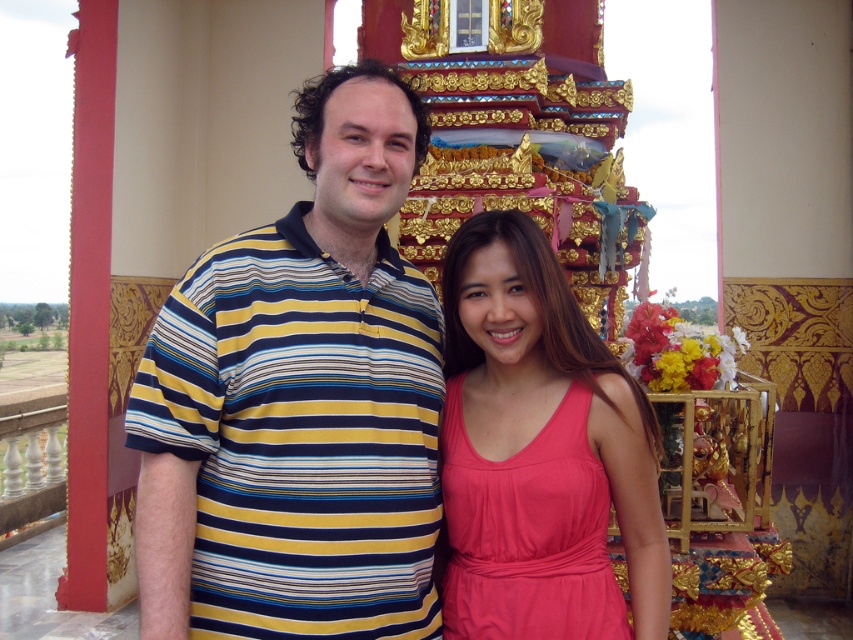
Between striped cotton shirt at center and pink satin dress at center, which one is positioned higher?

Positioned higher is striped cotton shirt at center.

Can you confirm if striped cotton shirt at center is positioned to the right of pink satin dress at center?

Incorrect, striped cotton shirt at center is not on the right side of pink satin dress at center.

Find the location of `striped cotton shirt at center`. striped cotton shirt at center is located at coordinates (299, 401).